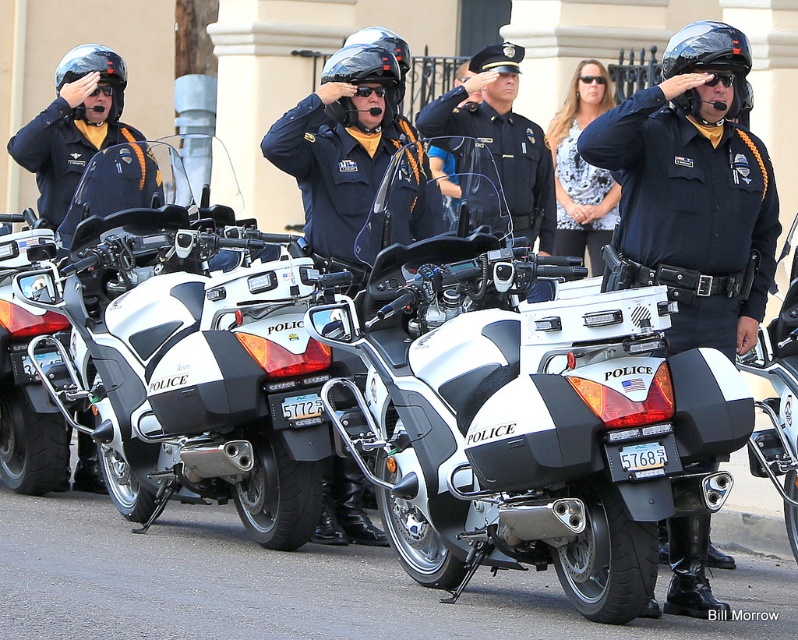
Question: Can you confirm if white matte police motorcycle at center is positioned to the right of white textured shirt at center?

Choices:
 (A) no
 (B) yes

Answer: (A)

Question: Is white matte police motorcycle at center to the right of glossy black helmet at center from the viewer's perspective?

Choices:
 (A) yes
 (B) no

Answer: (B)

Question: Is white matte police motorcycle at center bigger than black matte helmet at center?

Choices:
 (A) yes
 (B) no

Answer: (A)

Question: Which point appears farthest from the camera in this image?

Choices:
 (A) (85, 45)
 (B) (358, 58)
 (C) (591, 76)
 (D) (105, 461)

Answer: (C)

Question: Which object is farther from the camera taking this photo?

Choices:
 (A) black matte helmet at center
 (B) glossy black helmet at center
 (C) matte black helmet at left

Answer: (C)

Question: Which of the following is the farthest from the observer?

Choices:
 (A) (689, 36)
 (B) (87, 186)
 (C) (581, 172)

Answer: (C)